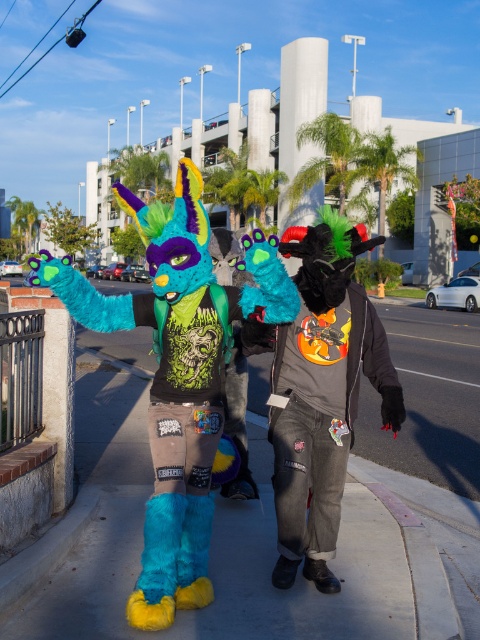
You are standing on the sidewalk and see the fuzzy teal costume at center. Where exactly is it positioned in relation to the other objects in the scene?

The fuzzy teal costume at center is located at point coordinates of 0.589 on the x axis and 0.375 on the y axis.

You are a photographer trying to capture both the fuzzy teal costume at center and the fuzzy teal and black costume at center in a single frame. Which costume should you focus on first to ensure both are in the frame?

The fuzzy teal and black costume at center should be focused on first since it is positioned behind the fuzzy teal costume at center, allowing you to adjust the framing to include both.